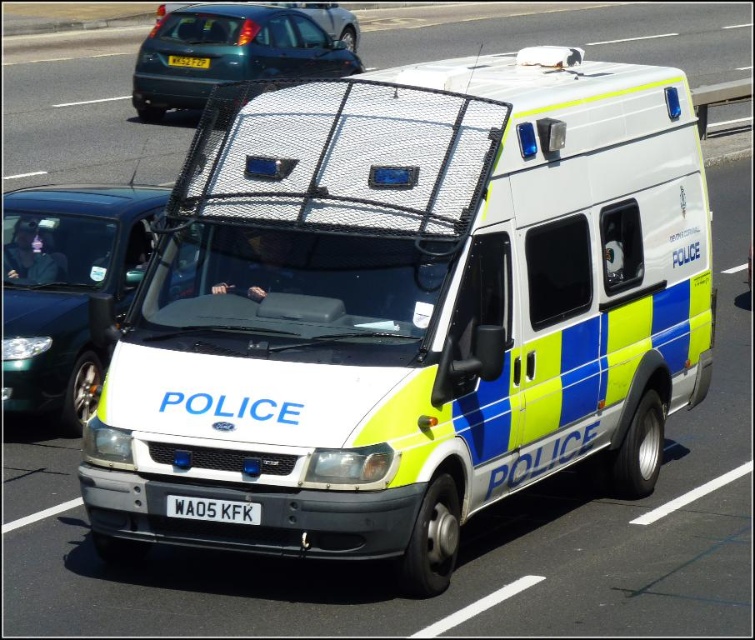
Question: Can you confirm if white glossy van at center is wider than white plastic license plate at center?

Choices:
 (A) yes
 (B) no

Answer: (A)

Question: Is yellow reflective van at center positioned at the back of yellow matte license plate at center?

Choices:
 (A) yes
 (B) no

Answer: (B)

Question: Which object is farther from the camera taking this photo?

Choices:
 (A) metallic blue car at upper left
 (B) white plastic license plate at center
 (C) metallic blue hatchback at upper left
 (D) yellow reflective van at center

Answer: (A)

Question: Is white glossy van at center bigger than white plastic license plate at center?

Choices:
 (A) no
 (B) yes

Answer: (B)

Question: Which object is the farthest from the metallic blue hatchback at upper left?

Choices:
 (A) yellow reflective van at center
 (B) white glossy van at center
 (C) yellow matte license plate at center
 (D) metallic blue car at upper left

Answer: (B)

Question: Estimate the real-world distances between objects in this image. Which object is closer to the white glossy van at center?

Choices:
 (A) yellow reflective van at center
 (B) metallic blue car at upper left
 (C) yellow matte license plate at center
 (D) metallic blue hatchback at upper left

Answer: (A)